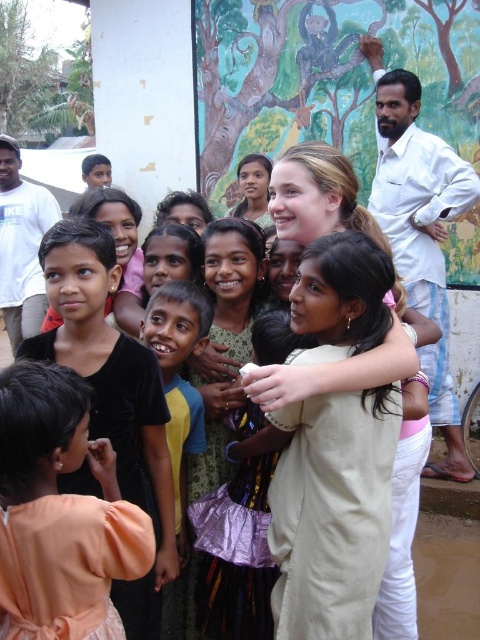
Does point (214, 192) lie in front of point (439, 252)?

No.

Image resolution: width=480 pixels, height=640 pixels. What are the coordinates of `painted mural at upper center` in the screenshot? It's located at (324, 77).

Find the location of a particular element. Image resolution: width=480 pixels, height=640 pixels. painted mural at upper center is located at coordinates (324, 77).

Does beige cotton dress at center have a smaller size compared to white cotton shirt at right?

Incorrect, beige cotton dress at center is not smaller in size than white cotton shirt at right.

Is point (347, 550) more distant than point (440, 308)?

That is False.

Find the location of a particular element. This screenshot has height=640, width=480. beige cotton dress at center is located at coordinates (333, 513).

Does beige cotton dress at center have a lesser width compared to light peach fabric dress at lower left?

No, beige cotton dress at center is not thinner than light peach fabric dress at lower left.

Does point (304, 332) come closer to viewer compared to point (136, 524)?

No, (304, 332) is behind (136, 524).

The width and height of the screenshot is (480, 640). In order to click on beige cotton dress at center in this screenshot , I will do `click(333, 513)`.